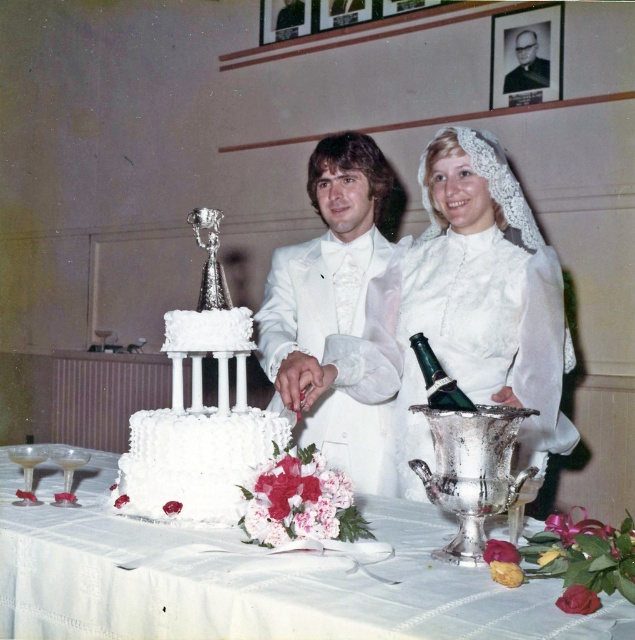
You are a guest at the wedding and want to know which cake is larger between the white frosted cake at center and the white textured cake at center. Can you tell me which one is bigger?

The white frosted cake at center is bigger than the white textured cake at center according to the description.

You are a photographer at the wedding. You need to adjust the lighting to highlight the white satin dress at center. Where should you position the light relative to the point marked as point (471,310)?

The point (471,310) is where the white satin dress at center is located. To highlight it, position the light directly in front of this point to ensure even illumination.